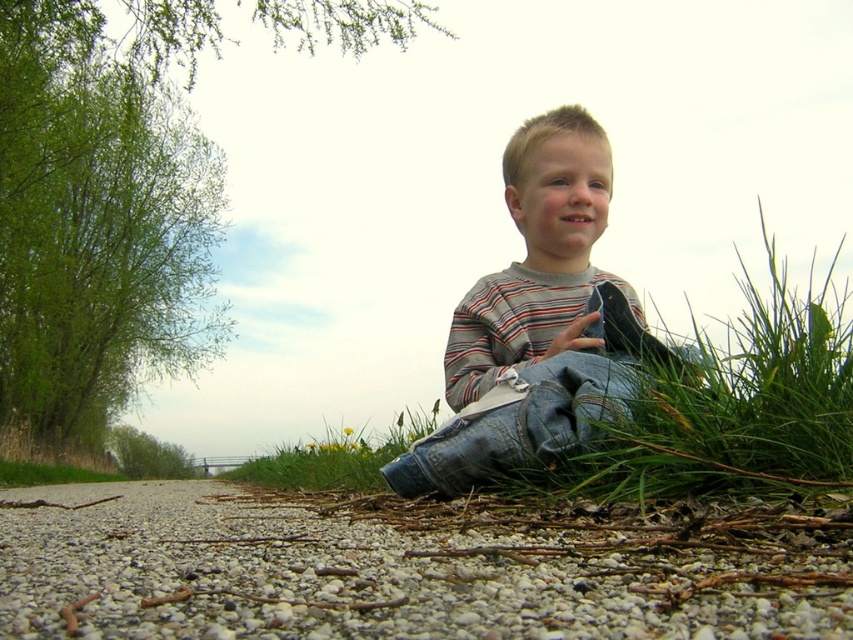
Question: Which point is farther to the camera?

Choices:
 (A) (283, 554)
 (B) (432, 422)
 (C) (515, 310)

Answer: (B)

Question: Which point is farther to the camera?

Choices:
 (A) (550, 413)
 (B) (309, 452)

Answer: (B)

Question: Can you confirm if striped cotton shirt at center is positioned below green grass at lower center?

Choices:
 (A) no
 (B) yes

Answer: (A)

Question: Which is nearer to the green grass at lower center?

Choices:
 (A) striped cotton shirt at center
 (B) gray gravel at lower center

Answer: (A)

Question: Is gray gravel at lower center further to camera compared to striped cotton shirt at center?

Choices:
 (A) yes
 (B) no

Answer: (B)

Question: Can you confirm if gray gravel at lower center is bigger than striped cotton shirt at center?

Choices:
 (A) yes
 (B) no

Answer: (A)